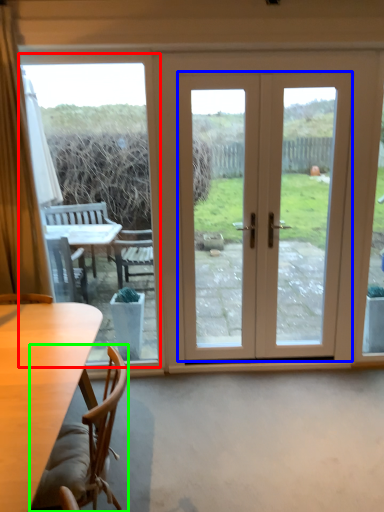
Question: Which object is positioned farthest from window screen (highlighted by a red box)? Select from door (highlighted by a blue box) and chair (highlighted by a green box).

Choices:
 (A) door
 (B) chair

Answer: (A)